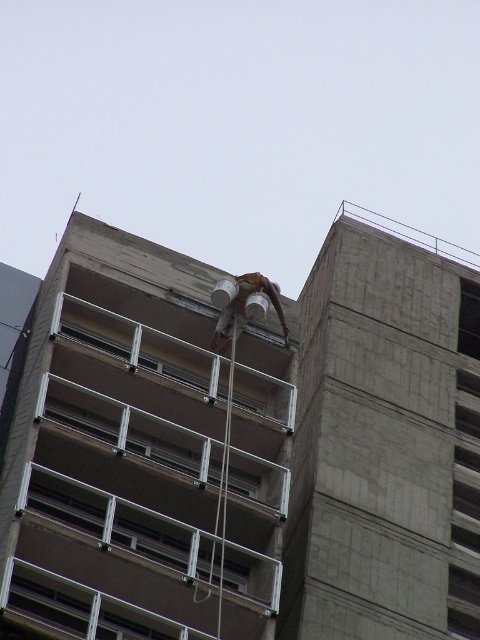
From the picture: Who is positioned more to the right, brown concrete balcony at center or brown leather helmet at center?

brown leather helmet at center is more to the right.

Between point (172, 480) and point (213, 304), which one is positioned behind?

Point (213, 304)

This screenshot has height=640, width=480. I want to click on brown concrete balcony at center, so click(x=144, y=486).